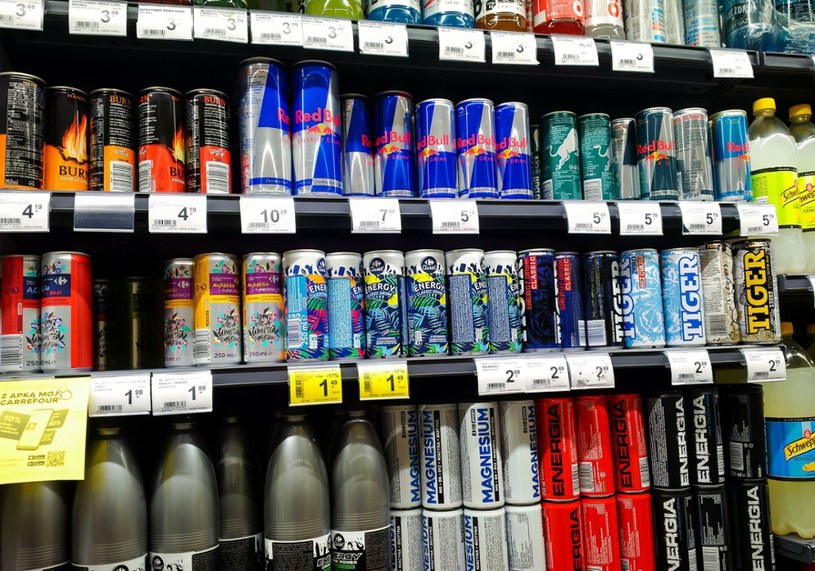
The height and width of the screenshot is (571, 815). In order to click on bottles on the bottom shelf in this screenshot , I will do `click(25, 538)`, `click(113, 534)`, `click(173, 530)`, `click(244, 518)`, `click(288, 516)`, `click(351, 498)`.